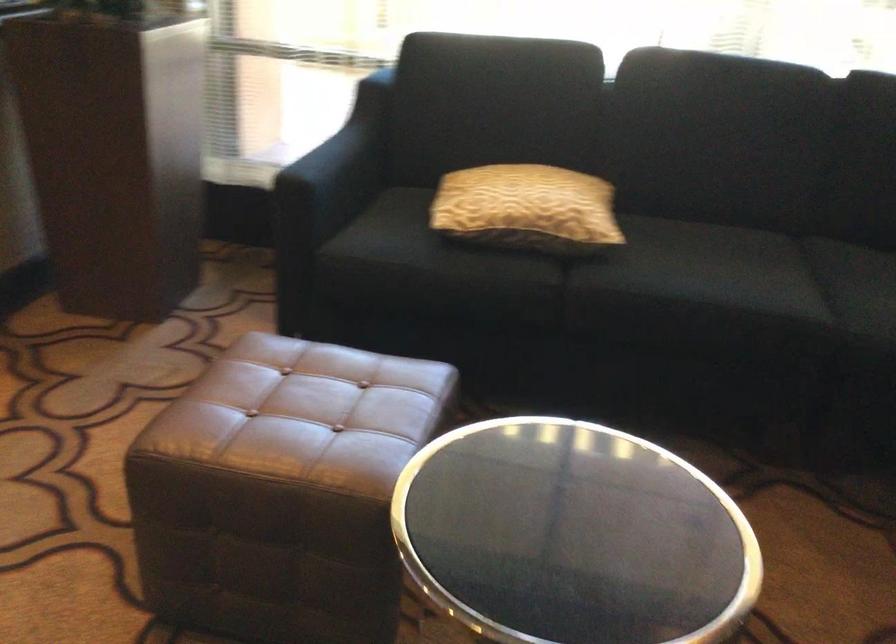
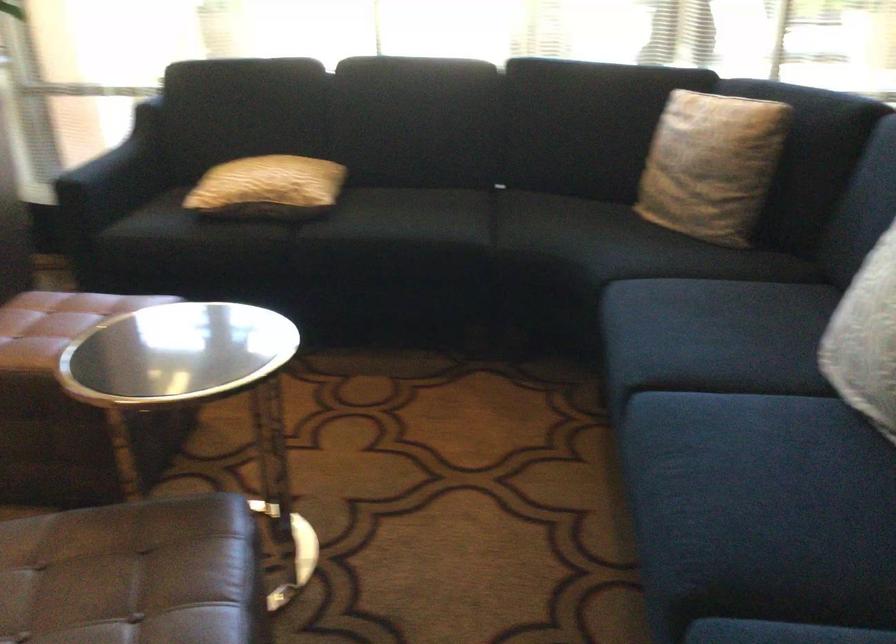
Find the pixel in the second image that matches the point at 341,178 in the first image.

(115, 176)